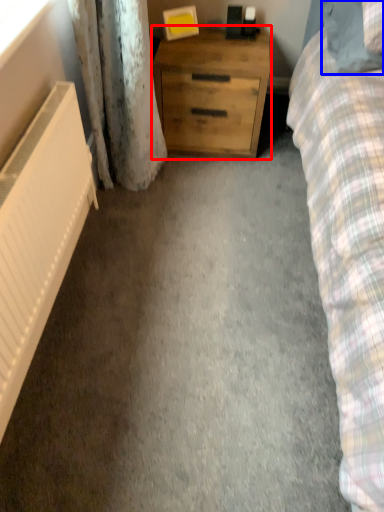
Question: Which object is closer to the camera taking this photo, chest of drawers (highlighted by a red box) or pillow (highlighted by a blue box)?

Choices:
 (A) chest of drawers
 (B) pillow

Answer: (B)